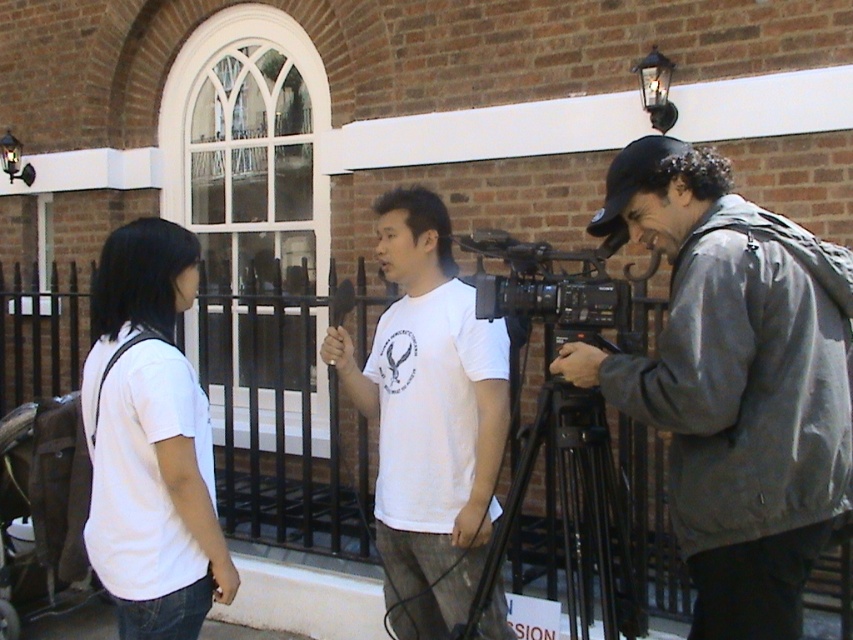
Which of these two, gray fabric jacket at right or white matte t-shirt at center, stands shorter?

With less height is gray fabric jacket at right.

Between gray fabric jacket at right and white matte t-shirt at center, which one is positioned higher?

Positioned higher is gray fabric jacket at right.

Is point (769, 634) closer to viewer compared to point (440, 604)?

That is True.

Locate an element on the screen. Image resolution: width=853 pixels, height=640 pixels. gray fabric jacket at right is located at coordinates (734, 381).

Who is more distant from viewer, (149, 435) or (566, 429)?

Positioned behind is point (566, 429).

Find the location of a particular element. white matte t-shirt at left is located at coordinates (151, 442).

Can you confirm if white matte t-shirt at left is smaller than black plastic video camera at center?

No, white matte t-shirt at left is not smaller than black plastic video camera at center.

Between point (148, 288) and point (544, 282), which one is positioned behind?

Positioned behind is point (544, 282).

Identify the location of white matte t-shirt at left. (151, 442).